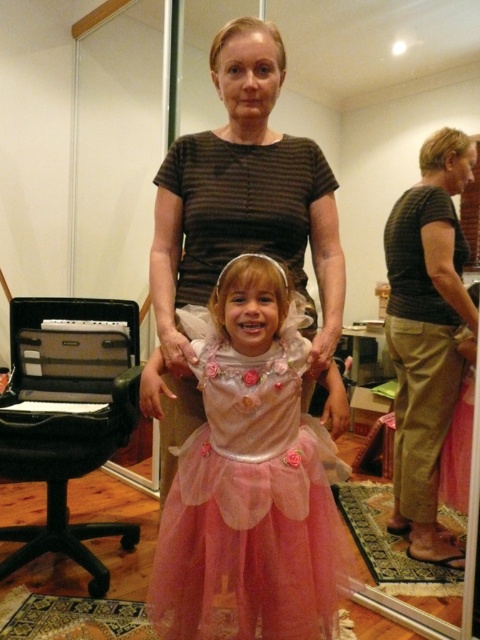
You are a photographer setting up for a family photo. You need to ensure that both the pink tulle dress at center and the matte brown shirt at upper right are fully visible in the frame. Based on their sizes, which object requires a wider shot to accommodate its size?

The pink tulle dress at center requires a wider shot because its width surpasses that of the matte brown shirt at upper right, so it needs more space to be fully visible.

Looking at this image, you are a photographer setting up for a family photo. You need to position a stool so both the pink tulle dress at center and the matte brown shirt at upper right are in frame. Which object is closer to the bottom edge of the photo?

The pink tulle dress at center is shorter than the matte brown shirt at upper right, so the pink tulle dress at center will be closer to the bottom edge of the photo.